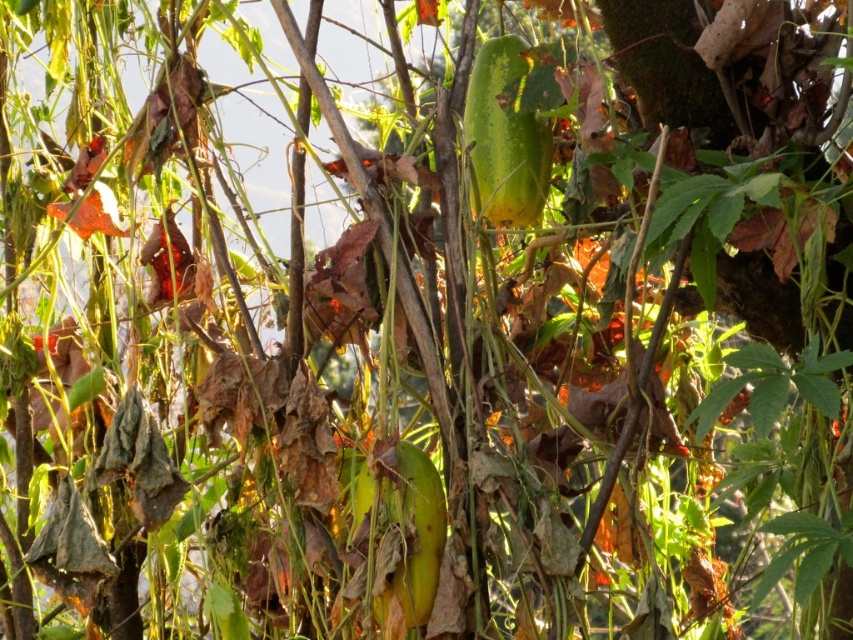
You are standing at the origin point in the center of the image. You want to reach the point labeled point (424, 616) first before moving to point (497, 147). Which path should you take first?

You should first go towards point (424, 616) before moving to point (497, 147) since point (497, 147) is behind point (424, 616).

You are a gardener who wants to harvest fruits from the scene. You see the green matte papaya at center and the green matte pickle at center. Which fruit is smaller in size?

The green matte papaya at center is smaller than the green matte pickle at center, so the green matte papaya at center is the smaller one.

You are a gardener trying to harvest fruits from the dense plant cluster. You see the green matte papaya at center and the green matte pickle at center. Which fruit is closer to you and easier to reach?

The green matte papaya at center is closer to you than the green matte pickle at center, so it is easier to reach.